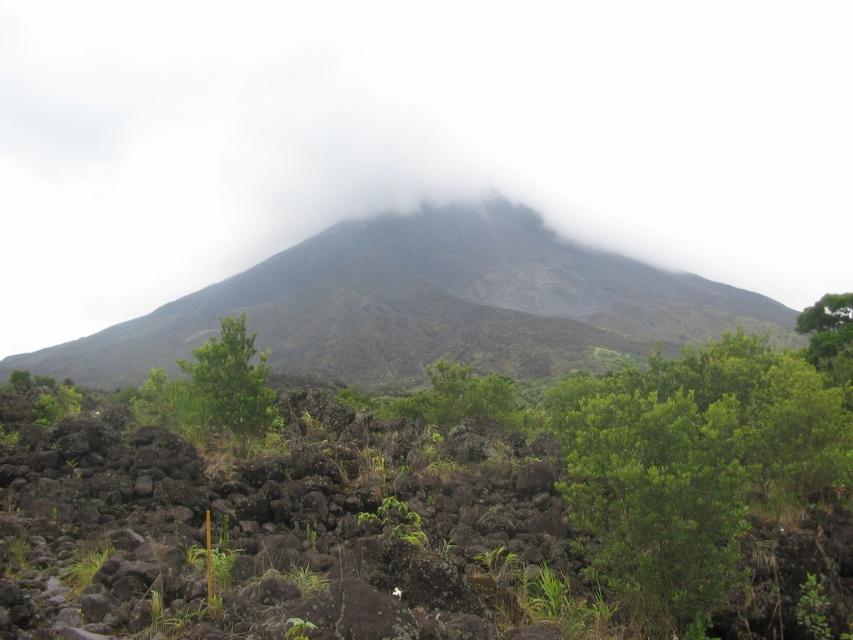
You are a hiker navigating the volcanic landscape and want to reach the point at the bottom of the volcano. You see two points marked on your map labeled as point 1 at coordinates point (233, 381) and point 2 at coordinates point (834, 321). Which point is closer to the base of the volcano?

Point (233, 381) is closer to the base of the volcano because it is in front of point (834, 321), meaning it is nearer to the observer.